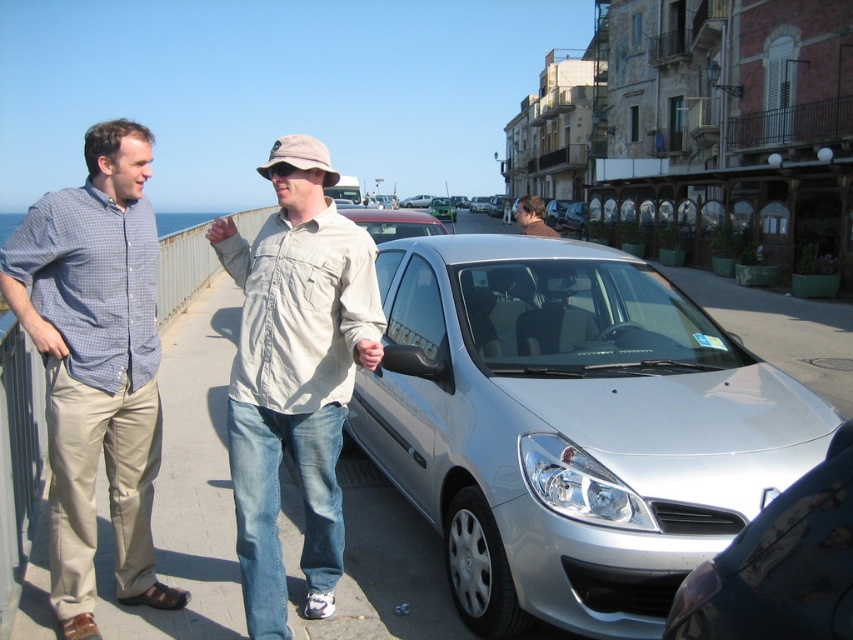
Question: Can you confirm if silver metallic car at center is thinner than satin silver sedan at center?

Choices:
 (A) yes
 (B) no

Answer: (B)

Question: Does matte blue shirt at left have a lesser width compared to satin silver sedan at center?

Choices:
 (A) no
 (B) yes

Answer: (A)

Question: Based on their relative distances, which object is nearer to the light beige cotton shirt at center?

Choices:
 (A) matte beige shirt at center
 (B) satin silver sedan at center
 (C) silver metallic car at center

Answer: (C)

Question: From the image, what is the correct spatial relationship of matte blue shirt at left in relation to satin silver sedan at center?

Choices:
 (A) left
 (B) right

Answer: (A)

Question: Which point is closer to the camera taking this photo?

Choices:
 (A) (144, 200)
 (B) (674, 621)
 (C) (331, 499)
 (D) (558, 518)

Answer: (B)

Question: Among these points, which one is nearest to the camera?

Choices:
 (A) (294, 150)
 (B) (834, 600)

Answer: (B)